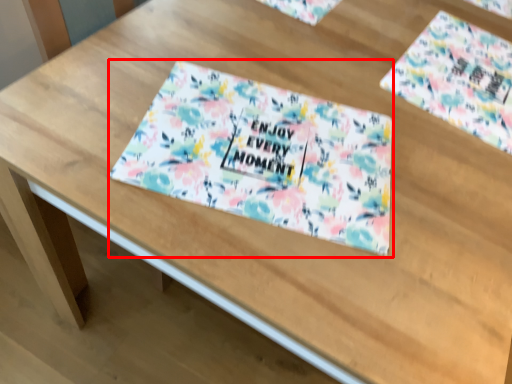
Question: From the image's perspective, where is tablecloth (annotated by the red box) located relative to flyer?

Choices:
 (A) below
 (B) above

Answer: (A)